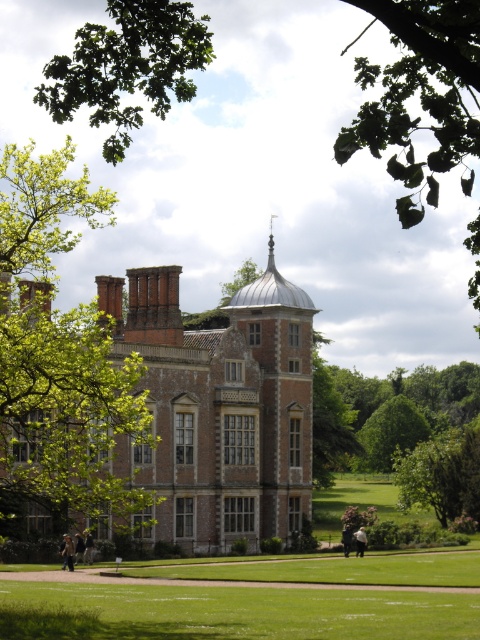
You are planning to host a picnic and need to choose between the green leafy tree at left and the green grass lawn at center for your picnic spot. Which location offers more shade coverage?

The green leafy tree at left is bigger than the green grass lawn at center, so it provides more shade coverage for the picnic.

You are standing in front of the grand historic building and want to take a photo. You notice two points marked on the building. The first point is at coordinates point [460,0], and the second is at point [372,628]. Which point appears closer to you in the photo?

The point at [460,0] is closer to the camera than the point at [372,628], so it will appear closer in the photo.

You are standing at the entrance of the historic building and want to take a photo of the green leafy tree at left. Which direction should you face to capture it in your camera view?

You should face towards the left side of the building to capture the green leafy tree at left in your camera view since it is located at point (59, 353), which is to the left of the entrance.